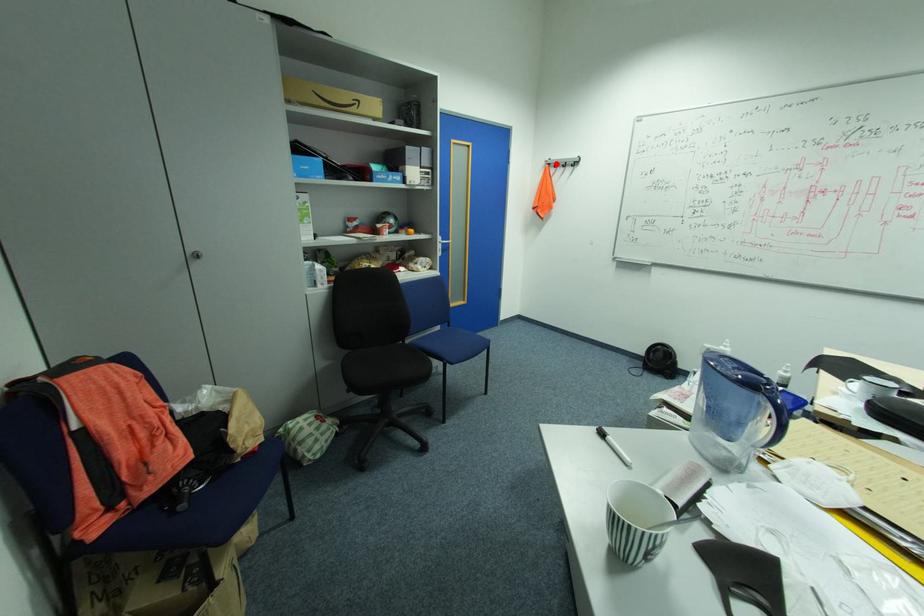
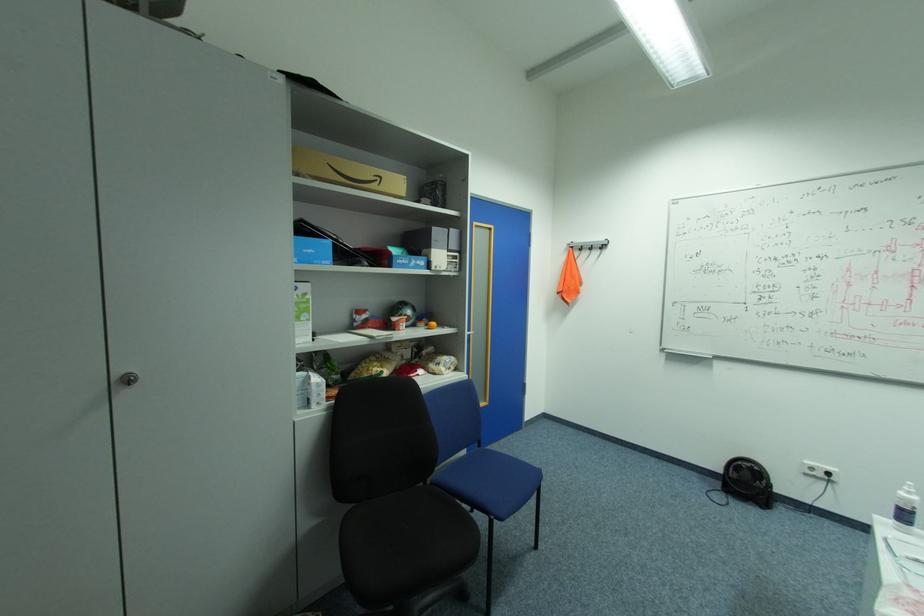
The point at the highlighted location is marked in the first image. Where is the corresponding point in the second image?

(578, 246)